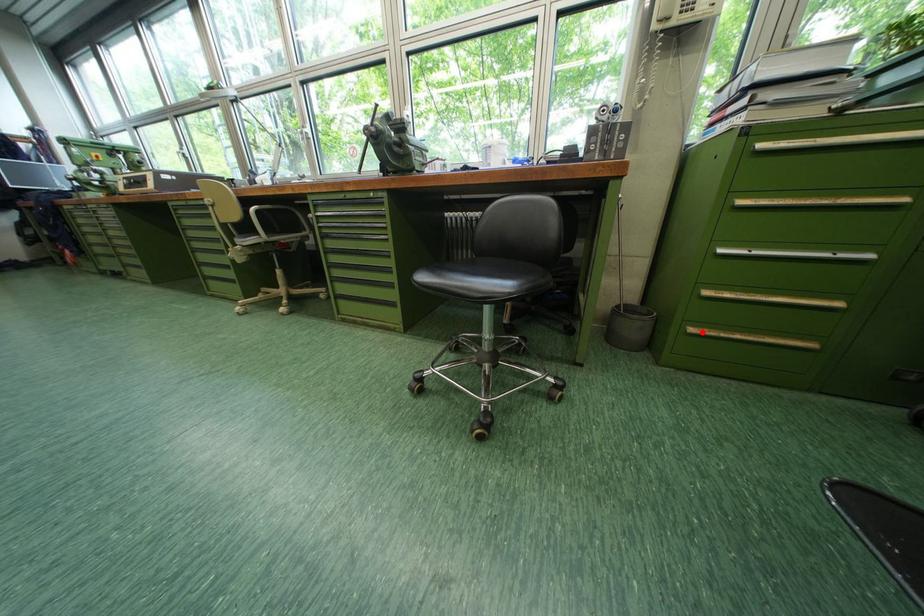
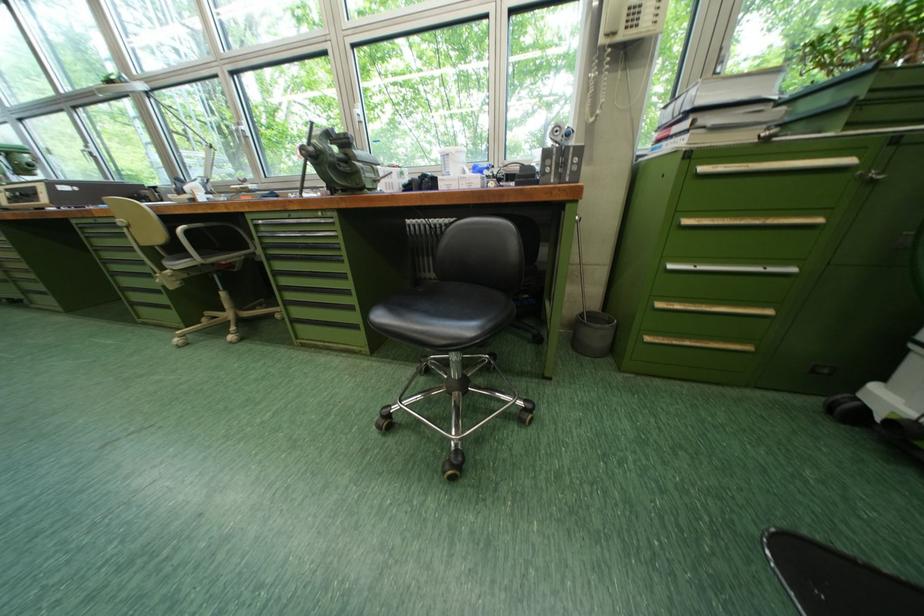
The point at the highlighted location is marked in the first image. Where is the corresponding point in the second image?

(659, 341)